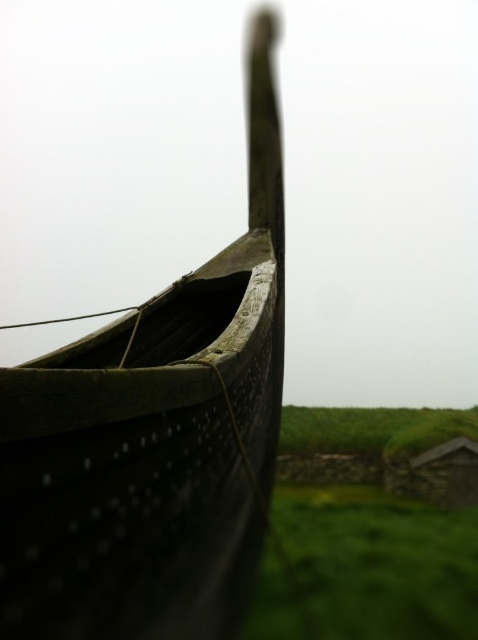
Between dark wood boat at center and green grassy at lower right, which one is positioned lower?

green grassy at lower right is below.

Between dark wood boat at center and green grassy at lower right, which one appears on the left side from the viewer's perspective?

Positioned to the left is dark wood boat at center.

Does point (3, 579) come in front of point (362, 547)?

Yes, it is.

The width and height of the screenshot is (478, 640). I want to click on dark wood boat at center, so click(x=154, y=436).